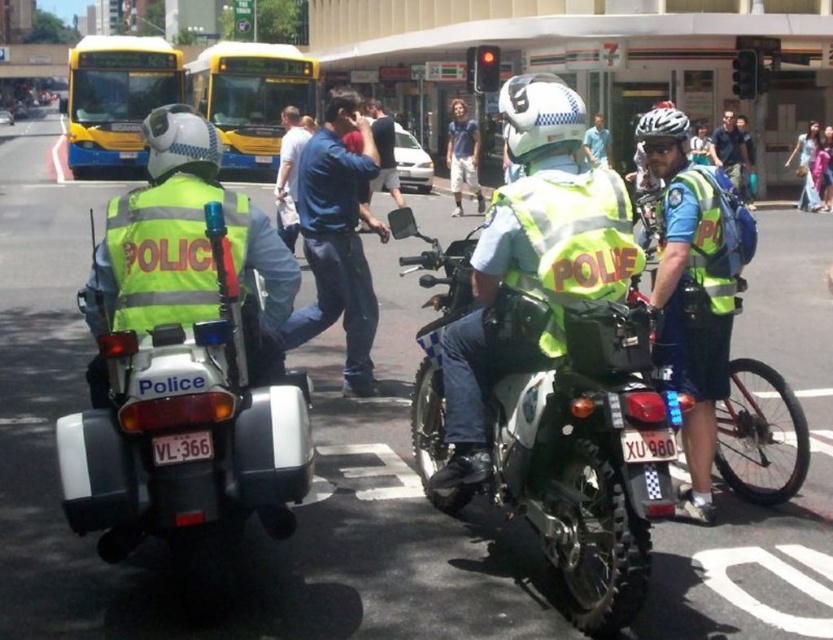
Question: Does reflective yellow vest at left have a larger size compared to reflective blue shirt at center?

Choices:
 (A) no
 (B) yes

Answer: (B)

Question: Which point is farther to the camera?

Choices:
 (A) (547, 435)
 (B) (237, 108)
 (C) (178, 216)
 (D) (719, 244)

Answer: (B)

Question: Is reflective blue shirt at center thinner than blue denim jeans at center?

Choices:
 (A) no
 (B) yes

Answer: (B)

Question: Which point is closer to the camera taking this photo?

Choices:
 (A) tap(228, 193)
 (B) tap(287, 161)
 (C) tap(666, 157)
 (D) tap(330, 314)

Answer: (A)

Question: Is reflective yellow vest at left above yellow metallic bus at upper left?

Choices:
 (A) yes
 (B) no

Answer: (B)

Question: Estimate the real-world distances between objects in this image. Which object is farther from the light blue jeans at center?

Choices:
 (A) blue jeans at center
 (B) blue denim jeans at center

Answer: (B)